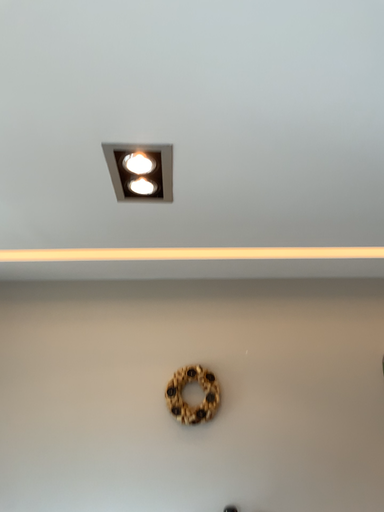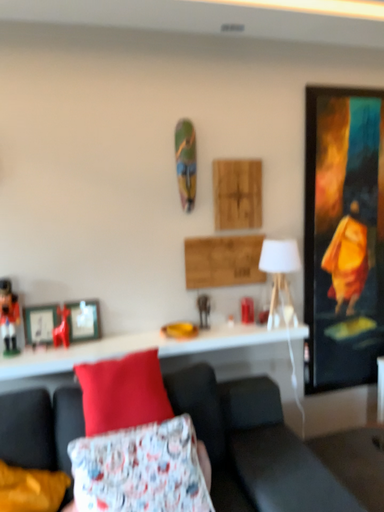
Question: How did the camera likely rotate when shooting the video?

Choices:
 (A) rotated upward
 (B) rotated downward

Answer: (B)